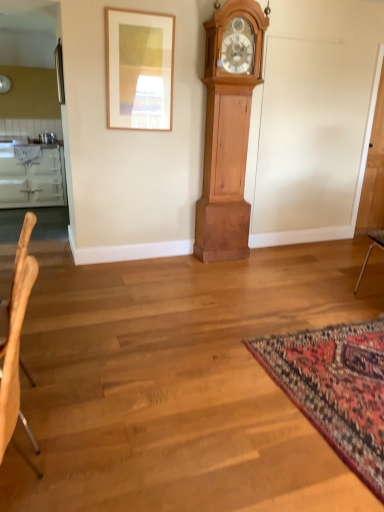
In order to face light brown wood grandfather clock at center, should I rotate leftwards or rightwards?

A 5.181 degree turn to the right will do.

What do you see at coordinates (228, 128) in the screenshot?
I see `light brown wood grandfather clock at center` at bounding box center [228, 128].

I want to click on light brown wood chair at left, so click(13, 354).

The height and width of the screenshot is (512, 384). Describe the element at coordinates (13, 354) in the screenshot. I see `light brown wood chair at left` at that location.

What do you see at coordinates (336, 388) in the screenshot? The height and width of the screenshot is (512, 384). I see `carpet with intricate patterns at lower right` at bounding box center [336, 388].

Locate an element on the screen. This screenshot has width=384, height=512. wooden picture frame at upper center is located at coordinates (139, 69).

I want to click on white glossy cabinetry at left, so click(x=32, y=176).

Which of these two, light brown wood grandfather clock at center or white glossy cabinetry at left, stands shorter?

white glossy cabinetry at left.

Between light brown wood grandfather clock at center and white glossy cabinetry at left, which one appears on the right side from the viewer's perspective?

From the viewer's perspective, light brown wood grandfather clock at center appears more on the right side.

From a real-world perspective, relative to white glossy cabinetry at left, is light brown wood grandfather clock at center vertically above or below?

light brown wood grandfather clock at center is situated higher than white glossy cabinetry at left in the real world.

Between light brown wood grandfather clock at center and white glossy cabinetry at left, which one has larger size?

white glossy cabinetry at left is bigger.

Is carpet with intricate patterns at lower right positioned far away from white glossy cabinetry at left?

Absolutely, carpet with intricate patterns at lower right is distant from white glossy cabinetry at left.

The width and height of the screenshot is (384, 512). I want to click on mat that appears in front of the white glossy cabinetry at left, so click(336, 388).

Which object is closer to the camera, carpet with intricate patterns at lower right or white glossy cabinetry at left?

carpet with intricate patterns at lower right is more forward.

From a real-world perspective, between carpet with intricate patterns at lower right and white glossy cabinetry at left, who is vertically lower?

carpet with intricate patterns at lower right.

From the image's perspective, which is below, light brown wood chair at left or wooden picture frame at upper center?

light brown wood chair at left is shown below in the image.

Is point (1, 403) farther from camera compared to point (144, 127)?

No, it is in front of (144, 127).

Is light brown wood chair at left oriented towards wooden picture frame at upper center?

No, light brown wood chair at left is not turned towards wooden picture frame at upper center.

Which of these two, light brown wood chair at left or wooden picture frame at upper center, stands taller?

wooden picture frame at upper center.

What's the angular difference between white glossy cabinetry at left and wooden picture frame at upper center's facing directions?

0.168 degrees separate the facing orientations of white glossy cabinetry at left and wooden picture frame at upper center.

Is white glossy cabinetry at left completely or partially outside of wooden picture frame at upper center?

white glossy cabinetry at left is positioned outside wooden picture frame at upper center.

Relative to wooden picture frame at upper center, is white glossy cabinetry at left in front or behind?

white glossy cabinetry at left is positioned farther from the viewer than wooden picture frame at upper center.

Looking at this image, is white glossy cabinetry at left taller than wooden picture frame at upper center?

Correct, white glossy cabinetry at left is much taller as wooden picture frame at upper center.

Could you tell me if wooden picture frame at upper center is turned towards carpet with intricate patterns at lower right?

No, wooden picture frame at upper center is not oriented towards carpet with intricate patterns at lower right.

Locate an element on the screen. mat located in front of the wooden picture frame at upper center is located at coordinates (336, 388).

Is there a large distance between wooden picture frame at upper center and carpet with intricate patterns at lower right?

Yes.

Is wooden picture frame at upper center outside of carpet with intricate patterns at lower right?

Indeed, wooden picture frame at upper center is completely outside carpet with intricate patterns at lower right.

Is carpet with intricate patterns at lower right far from light brown wood grandfather clock at center?

Yes, carpet with intricate patterns at lower right and light brown wood grandfather clock at center are located far from each other.

Which of these two, carpet with intricate patterns at lower right or light brown wood grandfather clock at center, is thinner?

Thinner between the two is light brown wood grandfather clock at center.

How different are the orientations of carpet with intricate patterns at lower right and light brown wood grandfather clock at center in degrees?

91.2 degrees.

Can you confirm if carpet with intricate patterns at lower right is positioned to the right of light brown wood grandfather clock at center?

Correct, you'll find carpet with intricate patterns at lower right to the right of light brown wood grandfather clock at center.

Which of these two, carpet with intricate patterns at lower right or wooden picture frame at upper center, is bigger?

Bigger between the two is carpet with intricate patterns at lower right.

From a real-world perspective, is carpet with intricate patterns at lower right below wooden picture frame at upper center?

Indeed, from a real-world perspective, carpet with intricate patterns at lower right is positioned beneath wooden picture frame at upper center.

Which is more to the left, carpet with intricate patterns at lower right or wooden picture frame at upper center?

From the viewer's perspective, wooden picture frame at upper center appears more on the left side.

Find the location of a particular element. Image resolution: width=384 pixels, height=512 pixels. wall clock on the right of white glossy cabinetry at left is located at coordinates (228, 128).

You are a GUI agent. You are given a task and a screenshot of the screen. Output one action in this format:
    pyautogui.click(x=<x>, y=<y>)
    Task: Click on the cabinetry on the left of carpet with intricate patterns at lower right
    
    Given the screenshot: What is the action you would take?
    pyautogui.click(x=32, y=176)

From the image, which object appears to be farther from white glossy cabinetry at left, light brown wood chair at left or light brown wood grandfather clock at center?

light brown wood chair at left is positioned further to the anchor white glossy cabinetry at left.

When comparing their distances from carpet with intricate patterns at lower right, does light brown wood grandfather clock at center or white glossy cabinetry at left seem closer?

light brown wood grandfather clock at center.

Which object lies nearer to the anchor point light brown wood chair at left, wooden picture frame at upper center or white glossy cabinetry at left?

wooden picture frame at upper center lies closer to light brown wood chair at left than the other object.

Estimate the real-world distances between objects in this image. Which object is further from white glossy cabinetry at left, light brown wood grandfather clock at center or carpet with intricate patterns at lower right?

The object further to white glossy cabinetry at left is carpet with intricate patterns at lower right.

Which object lies nearer to the anchor point white glossy cabinetry at left, wooden picture frame at upper center or light brown wood grandfather clock at center?

Based on the image, wooden picture frame at upper center appears to be nearer to white glossy cabinetry at left.

Which object lies nearer to the anchor point wooden picture frame at upper center, light brown wood chair at left or white glossy cabinetry at left?

light brown wood chair at left is closer to wooden picture frame at upper center.

Which object lies nearer to the anchor point light brown wood grandfather clock at center, carpet with intricate patterns at lower right or wooden picture frame at upper center?

wooden picture frame at upper center lies closer to light brown wood grandfather clock at center than the other object.

Looking at the image, which one is located further to light brown wood grandfather clock at center, light brown wood chair at left or white glossy cabinetry at left?

Among the two, white glossy cabinetry at left is located further to light brown wood grandfather clock at center.

Locate an element on the screen. This screenshot has height=512, width=384. wall clock between light brown wood chair at left and white glossy cabinetry at left along the z-axis is located at coordinates (228, 128).

Locate an element on the screen. picture frame between carpet with intricate patterns at lower right and white glossy cabinetry at left along the z-axis is located at coordinates (139, 69).

The height and width of the screenshot is (512, 384). I want to click on mat positioned between light brown wood chair at left and white glossy cabinetry at left from near to far, so click(x=336, y=388).

Where is `wall clock between wooden picture frame at upper center and carpet with intricate patterns at lower right in the up-down direction`? wall clock between wooden picture frame at upper center and carpet with intricate patterns at lower right in the up-down direction is located at coordinates (228, 128).